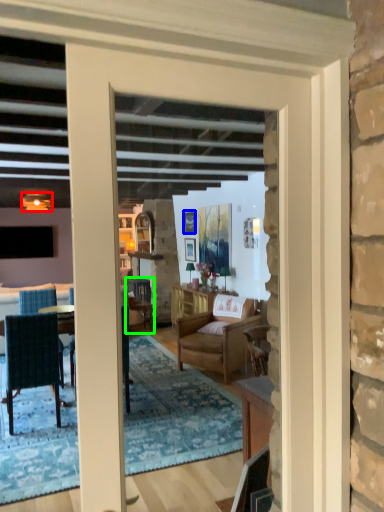
Question: Which object is the closest to the lamp (highlighted by a red box)? Choose among these: picture frame (highlighted by a blue box) or chair (highlighted by a green box).

Choices:
 (A) picture frame
 (B) chair

Answer: (B)